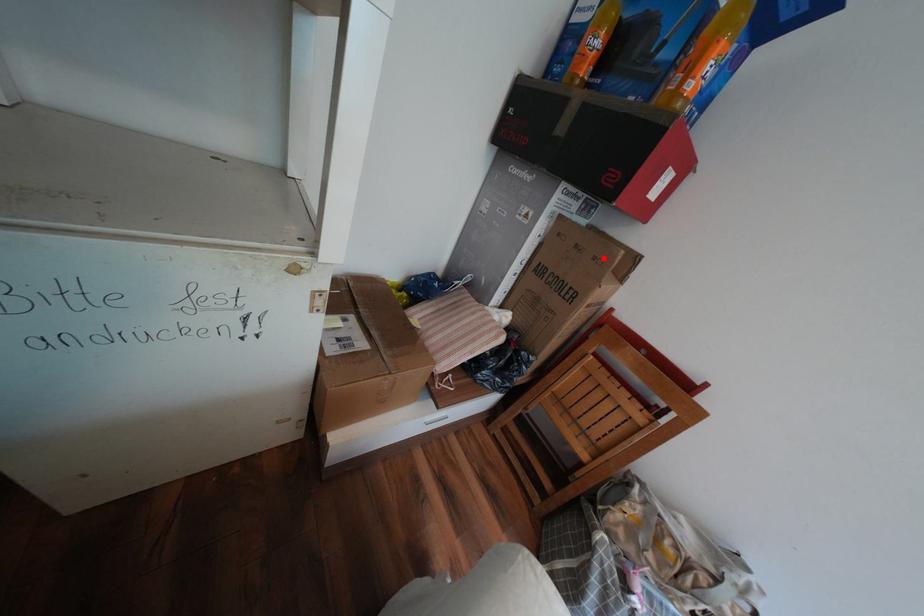
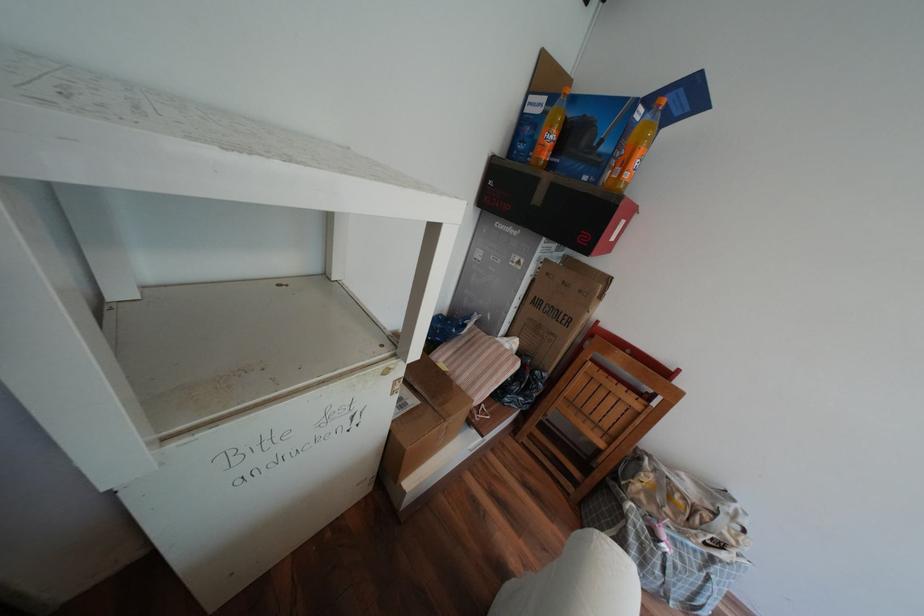
Question: I am providing you with two images of the same scene from different viewpoints. A red point is marked on the first image. Is the red point's position out of view in image 2?

Choices:
 (A) Yes
 (B) No

Answer: (B)